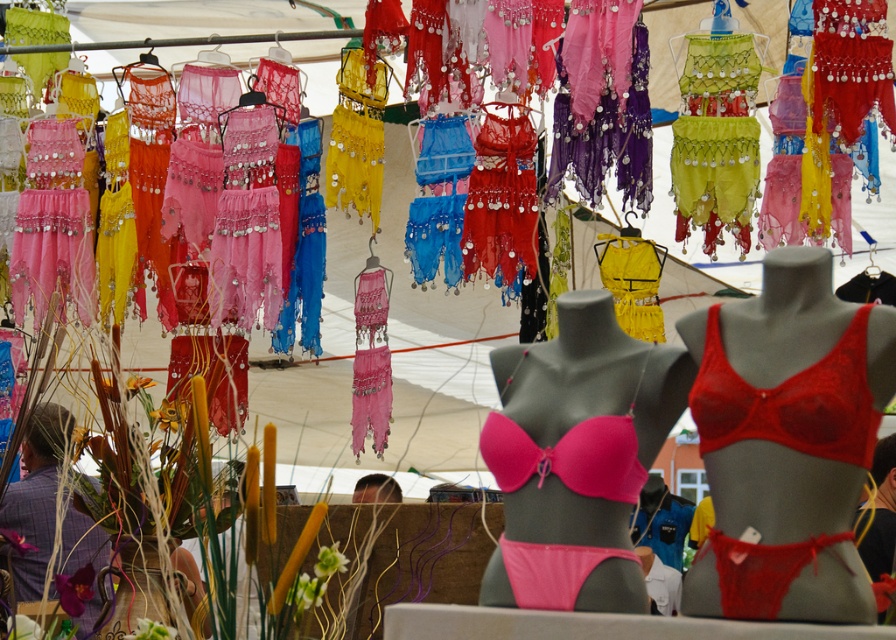
Question: From the image, what is the correct spatial relationship of pink matte bikini at center in relation to red lace bikini top at center?

Choices:
 (A) right
 (B) left

Answer: (B)

Question: Based on their relative distances, which object is nearer to the pink matte bikini at center?

Choices:
 (A) lace red bra at center
 (B) red lace bikini top at center

Answer: (A)

Question: Which point is closer to the camera?

Choices:
 (A) (621, 595)
 (B) (869, 342)

Answer: (B)

Question: Can you confirm if lace red bra at center is positioned to the right of pink matte bikini at center?

Choices:
 (A) yes
 (B) no

Answer: (A)

Question: Which of these objects is positioned farthest from the lace red bra at center?

Choices:
 (A) pink matte bikini at center
 (B) red lace bikini top at center

Answer: (A)

Question: Is lace red bra at center positioned at the back of pink matte bikini at center?

Choices:
 (A) yes
 (B) no

Answer: (B)